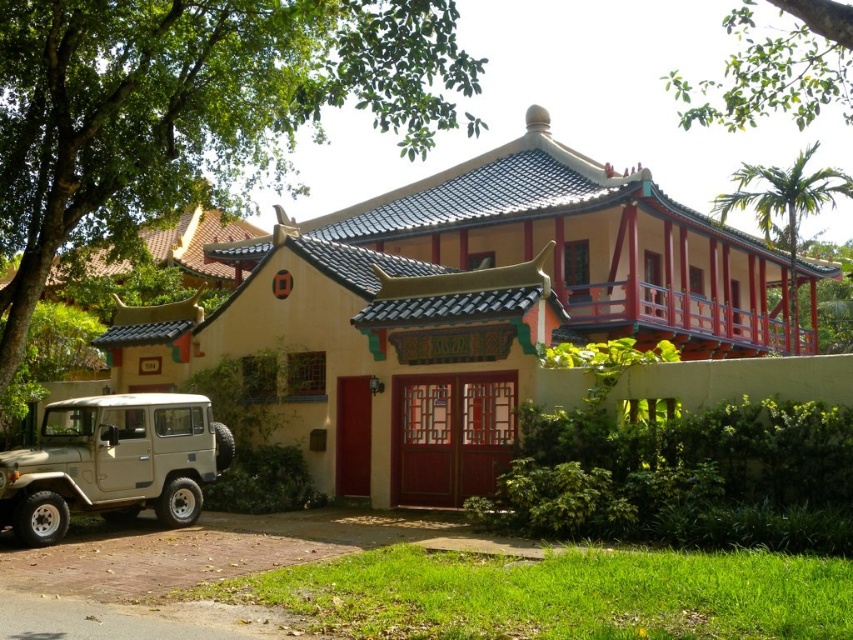
Question: Which point is closer to the camera taking this photo?

Choices:
 (A) (248, 8)
 (B) (740, 164)
 (C) (850, 80)
 (D) (125, 488)

Answer: (D)

Question: Is green leafy tree at upper left thinner than green leafy branch at upper center?

Choices:
 (A) yes
 (B) no

Answer: (A)

Question: Does green leafy branch at upper center appear under green leafy tree at upper right?

Choices:
 (A) yes
 (B) no

Answer: (B)

Question: Which point is farther to the camera?

Choices:
 (A) matte khaki jeep at lower left
 (B) green leafy tree at upper left
 (C) green leafy branch at upper center

Answer: (A)

Question: Which is nearer to the matte khaki jeep at lower left?

Choices:
 (A) green leafy tree at upper left
 (B) green leafy branch at upper center
 (C) green leafy tree at upper right

Answer: (A)

Question: Is matte khaki jeep at lower left below green leafy branch at upper center?

Choices:
 (A) yes
 (B) no

Answer: (A)